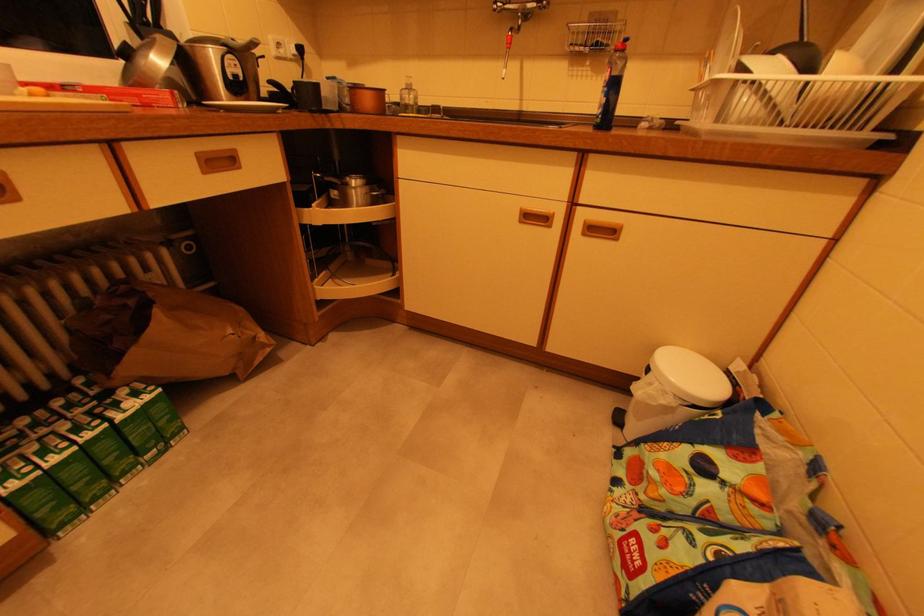
The image size is (924, 616). Describe the element at coordinates (519, 7) in the screenshot. I see `a faucet handle` at that location.